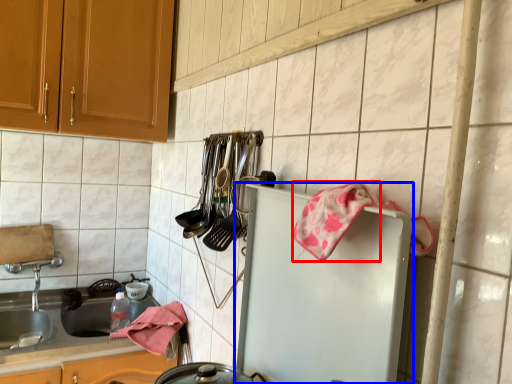
Question: Which of the following is the farthest to the observer, material (highlighted by a red box) or refrigerator (highlighted by a blue box)?

Choices:
 (A) material
 (B) refrigerator

Answer: (A)